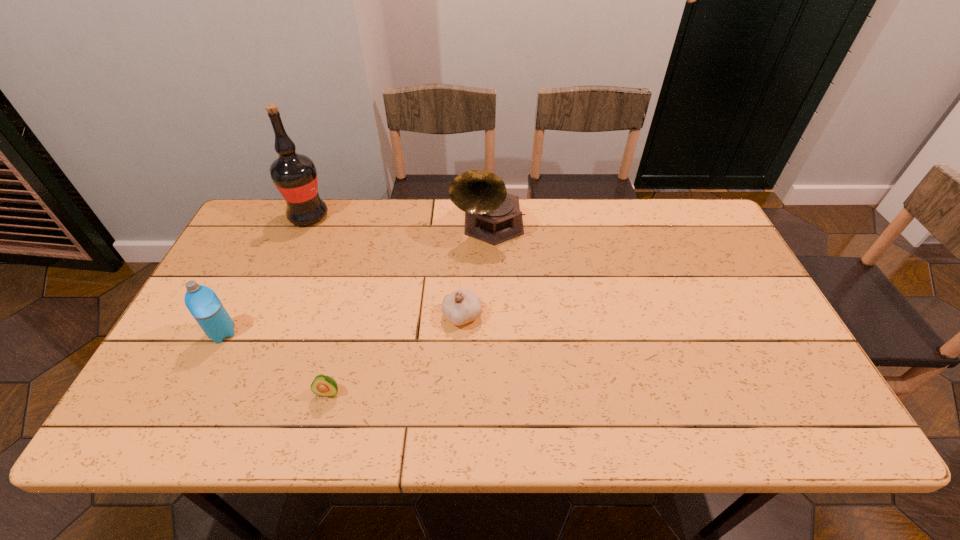
Where is `vacant space that is in between the nearest object and the tallest object`? vacant space that is in between the nearest object and the tallest object is located at coordinates (319, 305).

At what (x,y) coordinates should I click in order to perform the action: click on free space between the phonograph record and the tallest object. Please return your answer as a coordinate pair (x, y). The width and height of the screenshot is (960, 540). Looking at the image, I should click on (398, 221).

Where is `blank region between the garlic and the tallest object`? This screenshot has height=540, width=960. blank region between the garlic and the tallest object is located at coordinates (385, 266).

Identify which object is located as the third nearest to the third object from right to left. Please provide its 2D coordinates. Your answer should be formatted as a tuple, i.e. [(x, y)], where the tuple contains the x and y coordinates of a point satisfying the conditions above.

[(492, 215)]

Where is `object that is the second closest to the thermos bottle`? The height and width of the screenshot is (540, 960). object that is the second closest to the thermos bottle is located at coordinates (295, 176).